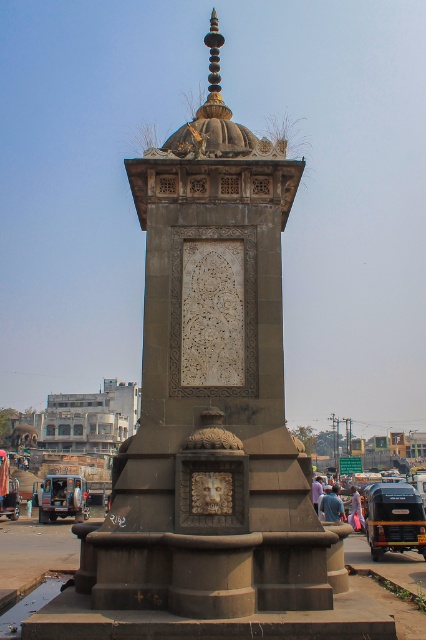
Describe the element at coordinates (394, 518) in the screenshot. Image resolution: width=426 pixels, height=640 pixels. I see `metallic blue truck at lower right` at that location.

Can you confirm if metallic blue truck at lower right is positioned to the right of metallic car at center?

Yes, metallic blue truck at lower right is to the right of metallic car at center.

Measure the distance between metallic blue truck at lower right and camera.

The distance of metallic blue truck at lower right from camera is 115.14 feet.

You are a GUI agent. You are given a task and a screenshot of the screen. Output one action in this format:
    pyautogui.click(x=<x>, y=<y>)
    Task: Click on the metallic blue truck at lower right
    
    Given the screenshot: What is the action you would take?
    pyautogui.click(x=394, y=518)

Is point (123, 493) farther from viewer compared to point (46, 476)?

No, it is not.

Is dark gray stone monument at center further to camera compared to blue metallic van at lower left?

No, dark gray stone monument at center is in front of blue metallic van at lower left.

Is point (216, 328) positioned behind point (71, 513)?

No, (216, 328) is in front of (71, 513).

Where is `dark gray stone monument at center`? dark gray stone monument at center is located at coordinates (210, 394).

Is metallic blue truck at lower right shorter than blue metallic van at lower left?

No, metallic blue truck at lower right is not shorter than blue metallic van at lower left.

Does metallic blue truck at lower right lie in front of blue metallic van at lower left?

That is True.

Image resolution: width=426 pixels, height=640 pixels. In order to click on metallic blue truck at lower right in this screenshot , I will do `click(394, 518)`.

The image size is (426, 640). I want to click on metallic blue truck at lower right, so click(394, 518).